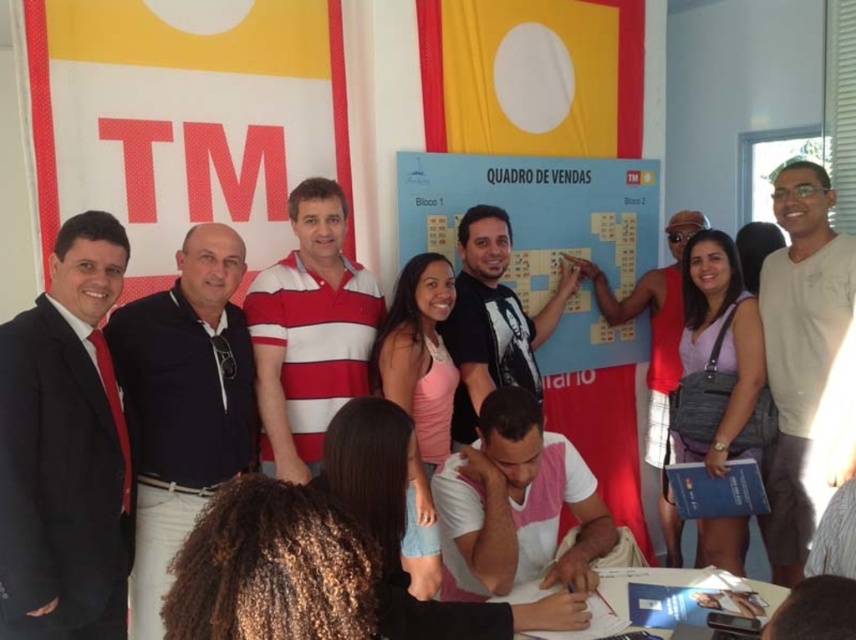
Based on the photo, you are organizing a photo shoot and need to position a matte black suit at left in the scene. According to the coordinates provided, where should you place it?

The matte black suit at left should be placed at point 0.702 along the x axis and 0.077 along the y axis.